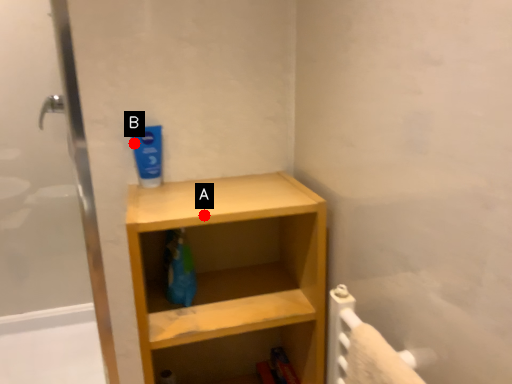
Question: Two points are circled on the image, labeled by A and B beside each circle. Which of the following is the closest to the observer?

Choices:
 (A) A is closer
 (B) B is closer

Answer: (A)